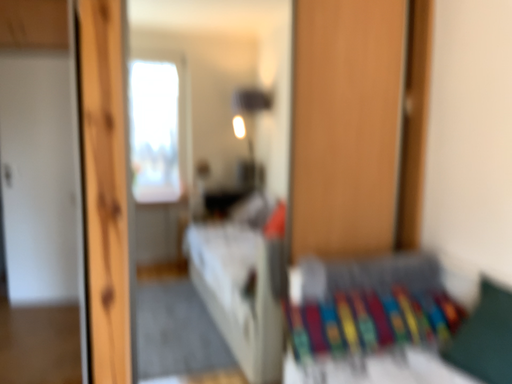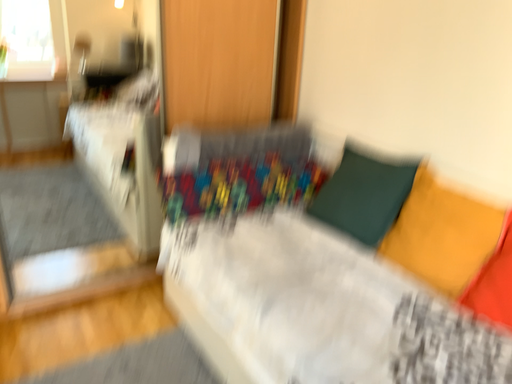
Question: Which way did the camera rotate in the video?

Choices:
 (A) rotated left
 (B) rotated right

Answer: (B)